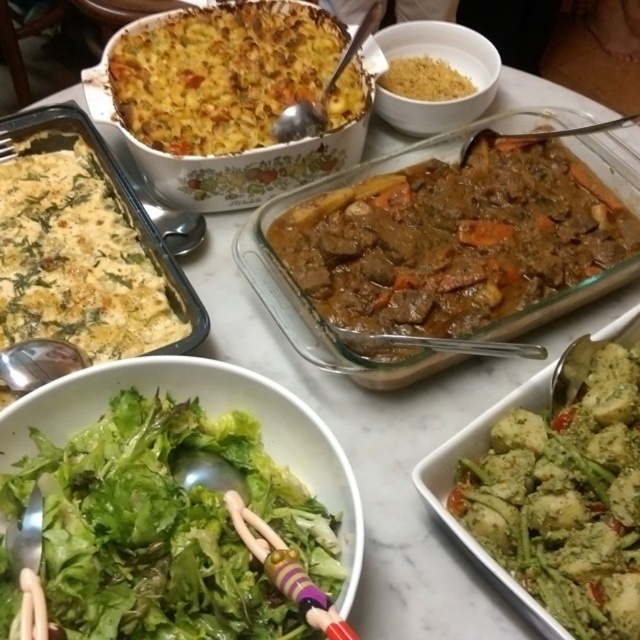
You are a guest at a dinner party and want to reach for the white creamy casserole at left and the brown crumbly at upper center. Which dish is closer to you?

The white creamy casserole at left is closer to you because it is in front of the brown crumbly at upper center.

You are a server who needs to deliver a drink to a guest seated exactly halfway between the green leafy salad at center and the brown crumbly at upper center. Can you place the drink on the table without moving either dish? Explain your reasoning.

The green leafy salad at center is 74.88 centimeters away from the brown crumbly at upper center. Since the guest is seated exactly halfway between them, the midpoint would be 37.44 centimeters from each dish. As long as there is enough space on the table at that midpoint to place the drink without disturbing the dishes, it should be possible. However, the exact feasibility depends on the size of the drink and whether any other objects are in that area, which aren